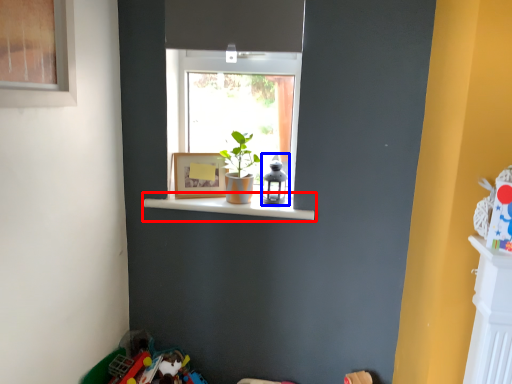
Question: Which object is closer to the camera taking this photo, window sill (highlighted by a red box) or toy (highlighted by a blue box)?

Choices:
 (A) window sill
 (B) toy

Answer: (A)